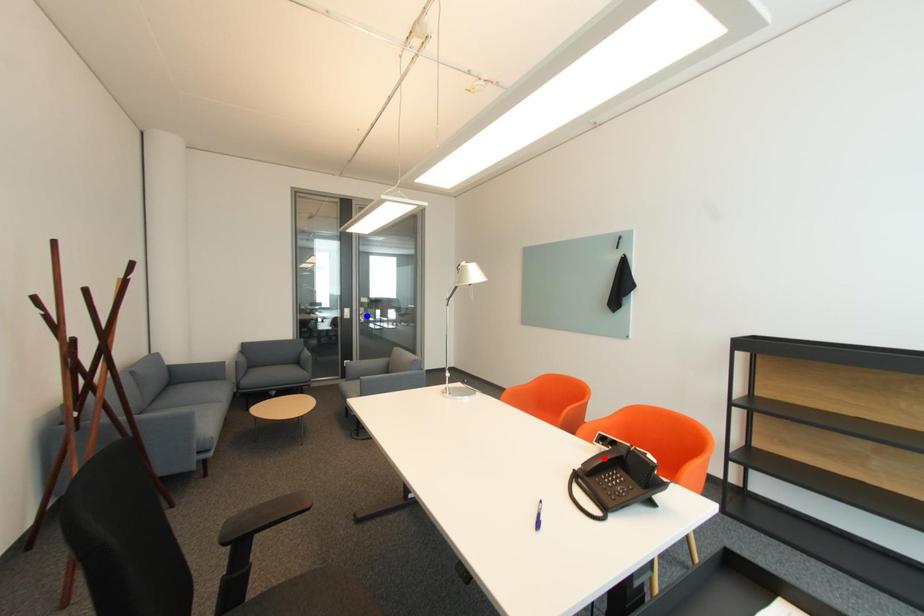
Question: Two points are marked on the image. Which point is closer to the camera?

Choices:
 (A) Blue point is closer.
 (B) Red point is closer.

Answer: (B)